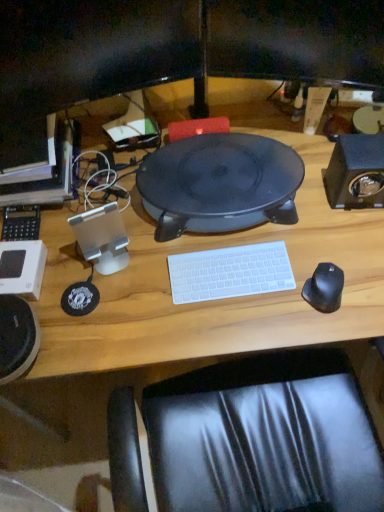
Locate an element on the screen. This screenshot has height=512, width=384. blank space to the left of black matte mouse at right is located at coordinates (259, 309).